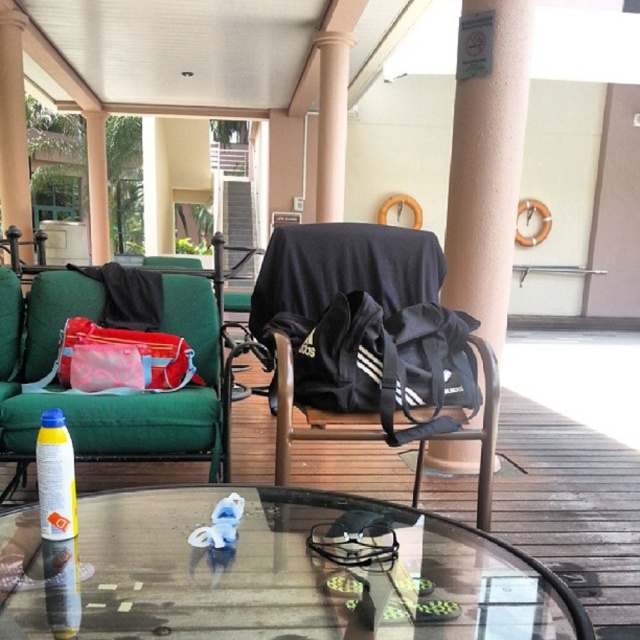
Question: Where is beige concrete pillar at center located in relation to matte red duffel bag at left in the image?

Choices:
 (A) above
 (B) below

Answer: (A)

Question: Where is matte red duffel bag at left located in relation to brown wood pillar at upper left in the image?

Choices:
 (A) above
 (B) below

Answer: (B)

Question: Which object is positioned closest to the matte red duffel bag at left?

Choices:
 (A) green fabric couch at left
 (B) transparent glass table at center
 (C) beige concrete pillar at center

Answer: (A)

Question: Is transparent glass table at center behind matte red duffel bag at left?

Choices:
 (A) no
 (B) yes

Answer: (A)

Question: Which of the following is the closest to the observer?

Choices:
 (A) brown wood pillar at upper left
 (B) matte red duffel bag at left
 (C) green fabric couch at left

Answer: (C)

Question: Which of the following is the farthest from the observer?

Choices:
 (A) yellow matte spray can at center
 (B) beige concrete pillar at center

Answer: (B)